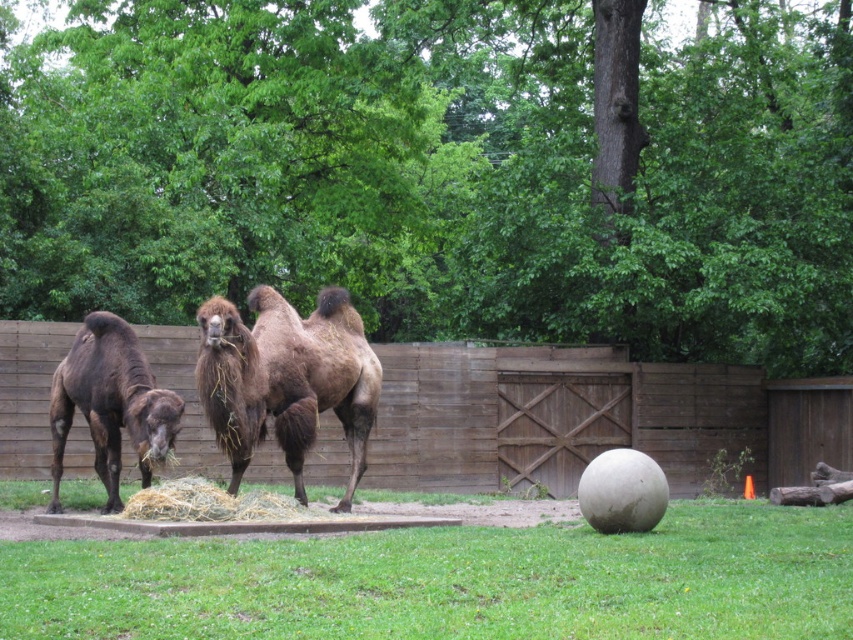
Question: Considering the relative positions of brown wooden fence at center and brown fuzzy camel at left in the image provided, where is brown wooden fence at center located with respect to brown fuzzy camel at left?

Choices:
 (A) right
 (B) left

Answer: (A)

Question: Which of the following is the farthest from the observer?

Choices:
 (A) brown wooden fence at center
 (B) brown fuzzy camel at left
 (C) green grass at lower center

Answer: (A)

Question: Among these points, which one is farthest from the camera?

Choices:
 (A) (135, 342)
 (B) (761, 625)

Answer: (A)

Question: Is brown wooden fence at center positioned at the back of brown fuzzy camel at center?

Choices:
 (A) yes
 (B) no

Answer: (A)

Question: Which point is closer to the camera taking this photo?

Choices:
 (A) (393, 412)
 (B) (314, 342)
 (C) (112, 413)
 (D) (495, 628)

Answer: (D)

Question: Is green grass at lower center behind brown fuzzy camel at center?

Choices:
 (A) yes
 (B) no

Answer: (B)